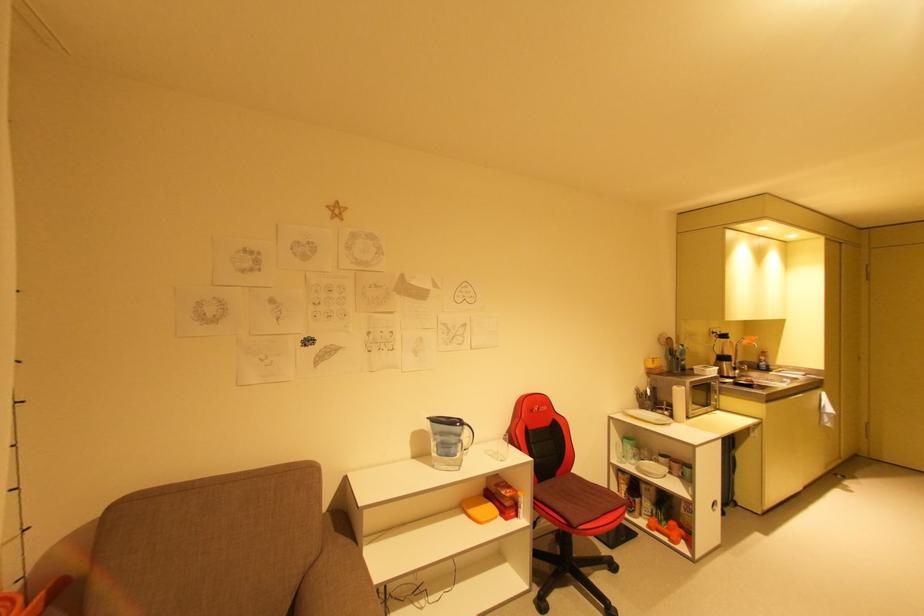
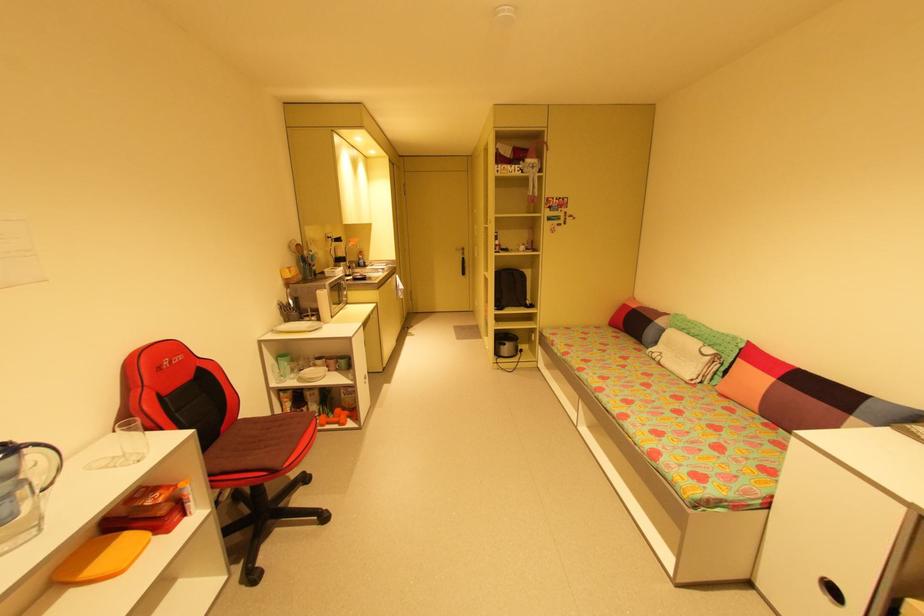
The point at (505, 458) is marked in the first image. Where is the corresponding point in the second image?

(139, 459)